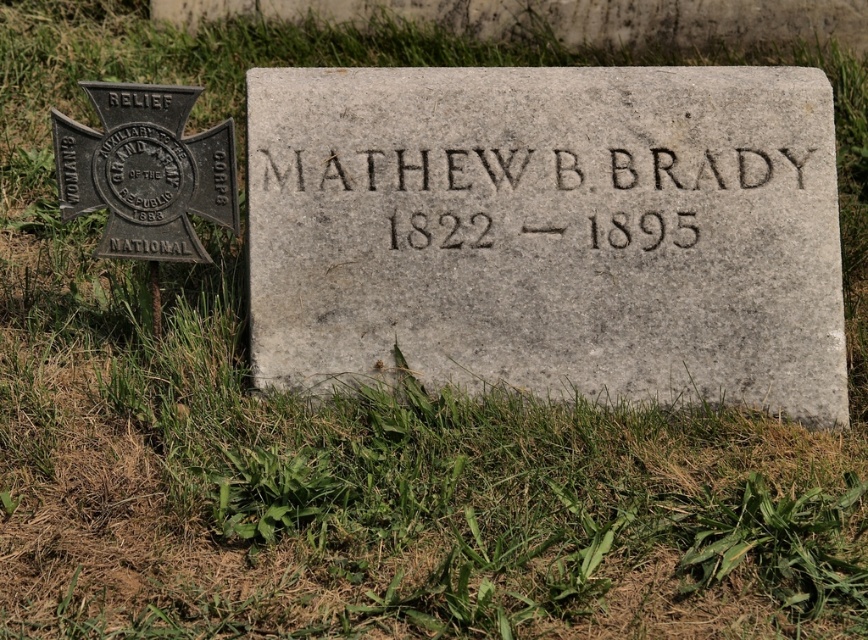
Question: Which point is closer to the camera?

Choices:
 (A) metallic cross at left
 (B) gray stone gravestone at center

Answer: (A)

Question: Can you confirm if gray stone gravestone at center is wider than metallic cross at left?

Choices:
 (A) yes
 (B) no

Answer: (A)

Question: Observing the image, what is the correct spatial positioning of gray stone gravestone at center in reference to black stone engraving at center?

Choices:
 (A) right
 (B) left

Answer: (A)

Question: Which of the following is the farthest from the observer?

Choices:
 (A) (793, 163)
 (B) (760, 365)
 (C) (125, 131)

Answer: (A)

Question: Which point is farther to the camera?

Choices:
 (A) metallic cross at left
 (B) gray stone gravestone at center

Answer: (B)

Question: Can you confirm if gray stone gravestone at center is wider than black stone engraving at center?

Choices:
 (A) yes
 (B) no

Answer: (A)